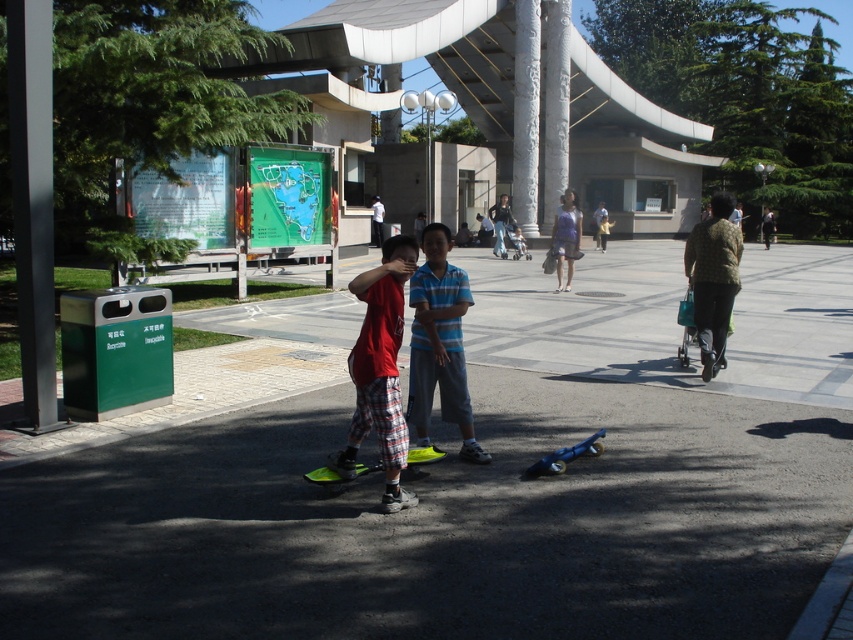
You are a photographer trying to capture a closeup of the red plaid shorts at center and the blue metallic skateboard at lower center in the scene. If you want to ensure both objects are in focus, which one should you adjust the camera focus to prioritize based on their sizes?

Since the red plaid shorts at center is bigger than the blue metallic skateboard at lower center, you should prioritize focusing on the red plaid shorts at center to ensure both are in focus.

You are a photographer trying to capture a photo of the dark gray asphalt at center and the purple fabric dress at center. Which object should you focus on if you want to emphasize the scale of the scene?

The dark gray asphalt at center has a larger size compared to the purple fabric dress at center, so focusing on the dark gray asphalt at center would better emphasize the scale of the scene.

You are standing at the point labeled point (393, 492) and want to walk towards the point labeled point (605, 429). Which direction should you face to walk directly towards it?

You should face towards the back direction because point (393, 492) is in front of point (605, 429), so to reach point (605, 429) from point (393, 492), you need to walk backward or face the opposite direction.